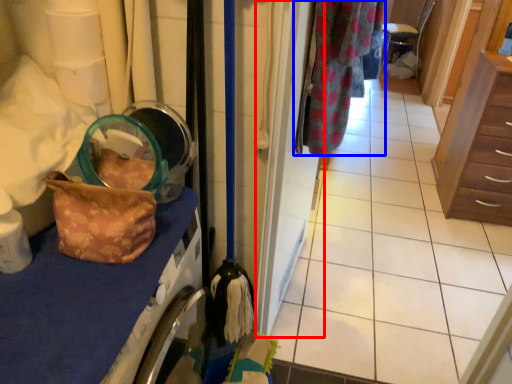
Question: Among these objects, which one is farthest to the camera, door (highlighted by a red box) or clothing (highlighted by a blue box)?

Choices:
 (A) door
 (B) clothing

Answer: (B)